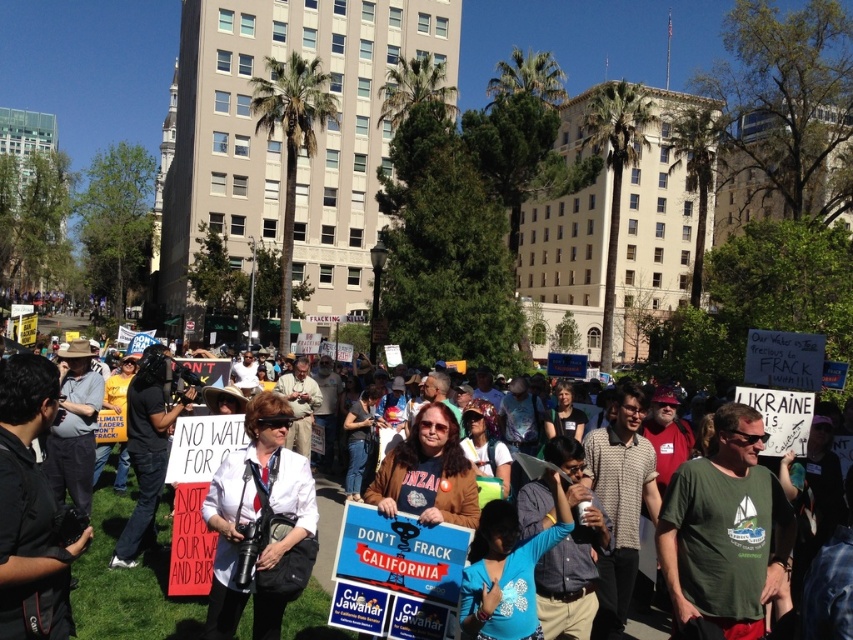
Is point (97, 621) positioned in front of point (270, 401)?

Yes, point (97, 621) is in front of point (270, 401).

Between point (668, 618) and point (265, 564), which one is positioned behind?

Point (668, 618)

From the picture: Measure the distance between point (x=148, y=624) and camera.

22.42 meters

The height and width of the screenshot is (640, 853). I want to click on white fabric shirt at center, so click(x=129, y=577).